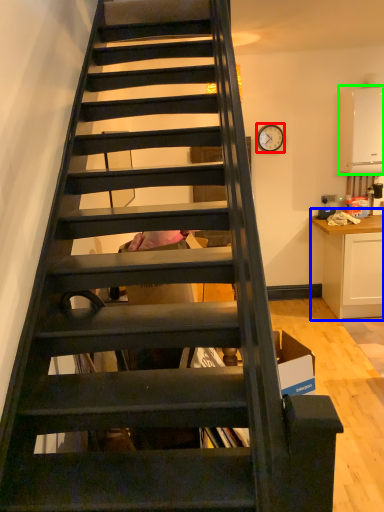
Question: Considering the real-world distances, which object is closest to clock (highlighted by a red box)? cabinetry (highlighted by a blue box) or appliance (highlighted by a green box).

Choices:
 (A) cabinetry
 (B) appliance

Answer: (B)